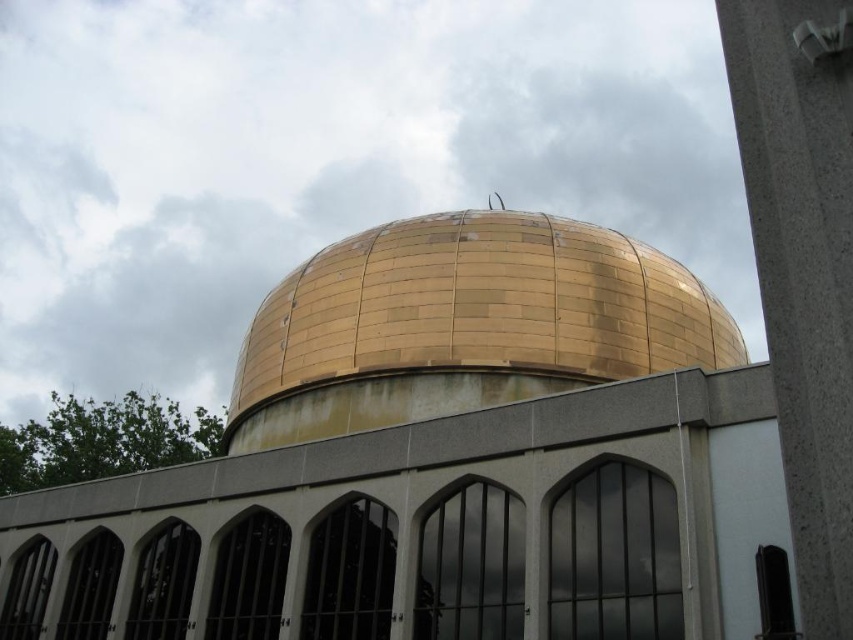
You are an architect evaluating the proportions of the building. Based on the image, which object is significantly taller between the gold metallic dome at center and the gray concrete pillar at right?

The gold metallic dome at center is much taller than the gray concrete pillar at right.

You are standing at the camera position and want to take a photo of the gold metallic dome at center. If your camera has a focal length of 50mm, what is the approximate size of the dome in millimeters on the camera sensor?

The gold metallic dome at center and camera are 105.02 feet apart from each other. Using the formula for calculating image size, which is object size divided by distance multiplied by focal length, we can determine the size. However, since the actual size of the dome isn not provided, we cannot compute an exact value. The question requires knowing the real dimensions of the dome to proceed.

You are an architect analyzing the building depicted in the image. You need to determine which object has a greater width between the gold metallic dome at center and the gray concrete pillar at right. Based on the scene, what is your conclusion?

The gold metallic dome at center has a greater width than the gray concrete pillar at right.